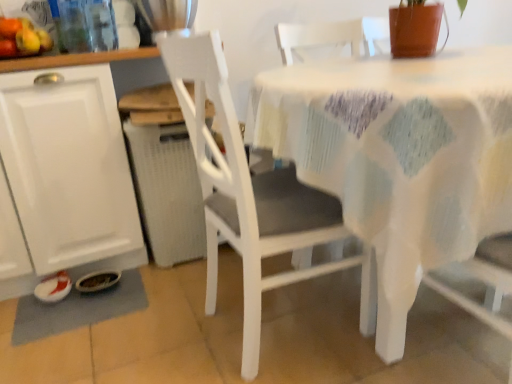
What do you see at coordinates (22, 38) in the screenshot? This screenshot has height=384, width=512. I see `shiny plastic fruits at upper left` at bounding box center [22, 38].

What do you see at coordinates (399, 157) in the screenshot? The height and width of the screenshot is (384, 512). I see `white fabric-covered table at center` at bounding box center [399, 157].

This screenshot has width=512, height=384. Identify the location of white fabric-covered table at center. (399, 157).

The height and width of the screenshot is (384, 512). What do you see at coordinates (77, 309) in the screenshot? I see `gray fabric place mat at lower left` at bounding box center [77, 309].

Measure the distance between point (8, 95) and camera.

Point (8, 95) and camera are 4.48 feet apart from each other.

Identify the location of white matte chair at center. The width and height of the screenshot is (512, 384). (252, 196).

Between shiny plastic fruits at upper left and white matte chair at center, which one appears on the left side from the viewer's perspective?

From the viewer's perspective, shiny plastic fruits at upper left appears more on the left side.

How many degrees apart are the facing directions of shiny plastic fruits at upper left and white matte chair at center?

There is a 94.5-degree angle between the facing directions of shiny plastic fruits at upper left and white matte chair at center.

Does point (45, 38) lie behind point (302, 278)?

Yes.

Is shiny plastic fruits at upper left smaller than white matte chair at center?

Yes, shiny plastic fruits at upper left is smaller than white matte chair at center.

Does white matte cabinet at left turn towards shiny plastic fruits at upper left?

No.

Can you confirm if white matte cabinet at left is thinner than shiny plastic fruits at upper left?

In fact, white matte cabinet at left might be wider than shiny plastic fruits at upper left.

Can you confirm if white matte cabinet at left is smaller than shiny plastic fruits at upper left?

Incorrect, white matte cabinet at left is not smaller in size than shiny plastic fruits at upper left.

Can you confirm if white matte cabinet at left is positioned to the right of shiny plastic fruits at upper left?

Yes, white matte cabinet at left is to the right of shiny plastic fruits at upper left.

Can you confirm if shiny plastic fruits at upper left is positioned to the right of white fabric-covered table at center?

No, shiny plastic fruits at upper left is not to the right of white fabric-covered table at center.

From a real-world perspective, is shiny plastic fruits at upper left on white fabric-covered table at center?

Yes, from a real-world perspective, shiny plastic fruits at upper left is on top of white fabric-covered table at center.

Is shiny plastic fruits at upper left wider or thinner than white fabric-covered table at center?

Clearly, shiny plastic fruits at upper left has less width compared to white fabric-covered table at center.

The image size is (512, 384). Identify the location of table below the shiny plastic fruits at upper left (from a real-world perspective). (399, 157).

Is white fabric-covered table at center inside the boundaries of white matte chair at center, or outside?

white fabric-covered table at center is not enclosed by white matte chair at center.

Does white fabric-covered table at center come behind white matte chair at center?

That is False.

Does point (406, 85) come behind point (159, 40)?

No.

Considering the points (68, 241) and (413, 131), which point is in front, point (68, 241) or point (413, 131)?

The point (413, 131) is closer.

From a real-world perspective, is white matte cabinet at left on top of white fabric-covered table at center?

Yes, from a real-world perspective, white matte cabinet at left is above white fabric-covered table at center.

Consider the image. From the image's perspective, is white matte cabinet at left beneath white fabric-covered table at center?

Actually, white matte cabinet at left appears above white fabric-covered table at center in the image.

Is white matte cabinet at left oriented away from white fabric-covered table at center?

No, white matte cabinet at left is not facing away from white fabric-covered table at center.

Considering the relative positions of white matte chair at center and white matte cabinet at left in the image provided, is white matte chair at center to the right of white matte cabinet at left from the viewer's perspective?

Yes, white matte chair at center is to the right of white matte cabinet at left.

In the scene shown: Is white matte chair at center not close to white matte cabinet at left?

They are positioned close to each other.

Is white matte chair at center looking in the opposite direction of white matte cabinet at left?

No, white matte chair at center is not facing away from white matte cabinet at left.

Based on their sizes in the image, would you say white matte chair at center is bigger or smaller than white matte cabinet at left?

white matte chair at center is smaller than white matte cabinet at left.

Considering the sizes of gray fabric place mat at lower left and shiny plastic fruits at upper left in the image, is gray fabric place mat at lower left wider or thinner than shiny plastic fruits at upper left?

Considering their sizes, gray fabric place mat at lower left looks broader than shiny plastic fruits at upper left.

From a real-world perspective, which is physically below, gray fabric place mat at lower left or shiny plastic fruits at upper left?

From a 3D spatial view, gray fabric place mat at lower left is below.

Is point (21, 329) in front of point (1, 28)?

No, it is behind (1, 28).

Between gray fabric place mat at lower left and shiny plastic fruits at upper left, which one has more height?

shiny plastic fruits at upper left.

At what (x,y) coordinates should I click in order to perform the action: click on fruit above the white matte chair at center (from the image's perspective). Please return your answer as a coordinate pair (x, y). Looking at the image, I should click on (22, 38).

At what (x,y) coordinates should I click in order to perform the action: click on cabinetry that is in front of the shiny plastic fruits at upper left. Please return your answer as a coordinate pair (x, y). This screenshot has width=512, height=384. Looking at the image, I should click on (68, 173).

When comparing their distances from white matte cabinet at left, does shiny plastic fruits at upper left or white matte chair at center seem further?

white matte chair at center is positioned further to the anchor white matte cabinet at left.

Estimate the real-world distances between objects in this image. Which object is closer to white fabric-covered table at center, white matte chair at center or gray fabric place mat at lower left?

white matte chair at center.

From the picture: From the image, which object appears to be nearer to gray fabric place mat at lower left, white matte chair at center or shiny plastic fruits at upper left?

white matte chair at center lies closer to gray fabric place mat at lower left than the other object.

From the image, which object appears to be nearer to shiny plastic fruits at upper left, white matte cabinet at left or gray fabric place mat at lower left?

white matte cabinet at left is positioned closer to the anchor shiny plastic fruits at upper left.

Looking at the image, which one is located further to white matte chair at center, white fabric-covered table at center or white matte cabinet at left?

white matte cabinet at left.

From the image, which object appears to be farther from white fabric-covered table at center, gray fabric place mat at lower left or white matte cabinet at left?

Among the two, gray fabric place mat at lower left is located further to white fabric-covered table at center.

When comparing their distances from gray fabric place mat at lower left, does white matte cabinet at left or white matte chair at center seem closer?

white matte cabinet at left is closer to gray fabric place mat at lower left.

Estimate the real-world distances between objects in this image. Which object is further from gray fabric place mat at lower left, white fabric-covered table at center or white matte chair at center?

white fabric-covered table at center lies further to gray fabric place mat at lower left than the other object.

Locate an element on the screen. chair situated between white matte cabinet at left and white fabric-covered table at center from left to right is located at coordinates (252, 196).

Locate an element on the screen. The image size is (512, 384). cabinetry between shiny plastic fruits at upper left and gray fabric place mat at lower left vertically is located at coordinates (68, 173).

Where is `chair located between gray fabric place mat at lower left and white fabric-covered table at center in the left-right direction`? chair located between gray fabric place mat at lower left and white fabric-covered table at center in the left-right direction is located at coordinates (252, 196).

Locate an element on the screen. The image size is (512, 384). chair between shiny plastic fruits at upper left and gray fabric place mat at lower left in the vertical direction is located at coordinates (252, 196).